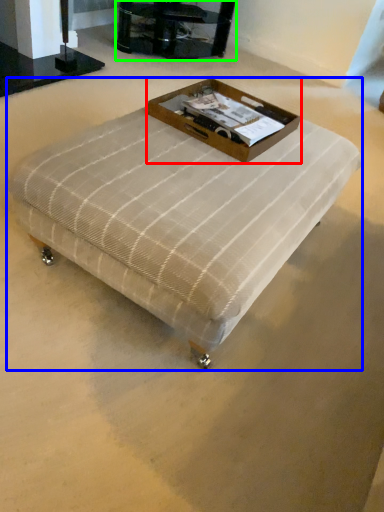
Question: Which is nearer to the box (highlighted by a red box)? table (highlighted by a blue box) or furniture (highlighted by a green box).

Choices:
 (A) table
 (B) furniture

Answer: (A)